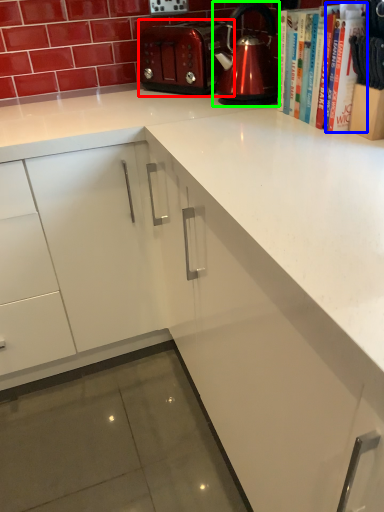
Question: Which object is the farthest from toaster (highlighted by a red box)? Choose among these: book (highlighted by a blue box) or kettle (highlighted by a green box).

Choices:
 (A) book
 (B) kettle

Answer: (A)